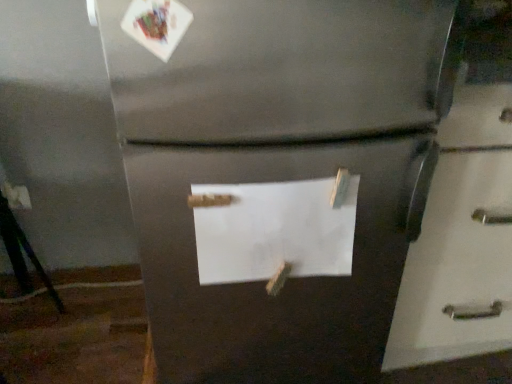
The width and height of the screenshot is (512, 384). Describe the element at coordinates (275, 229) in the screenshot. I see `white paper at center` at that location.

You are a GUI agent. You are given a task and a screenshot of the screen. Output one action in this format:
    pyautogui.click(x=<x>, y=<y>)
    Task: Click on the white paper at center
    The height and width of the screenshot is (384, 512).
    Given the screenshot: What is the action you would take?
    pyautogui.click(x=275, y=229)

At what (x,y) coordinates should I click in order to perform the action: click on white paper at center. Please return your answer as a coordinate pair (x, y). Looking at the image, I should click on (275, 229).